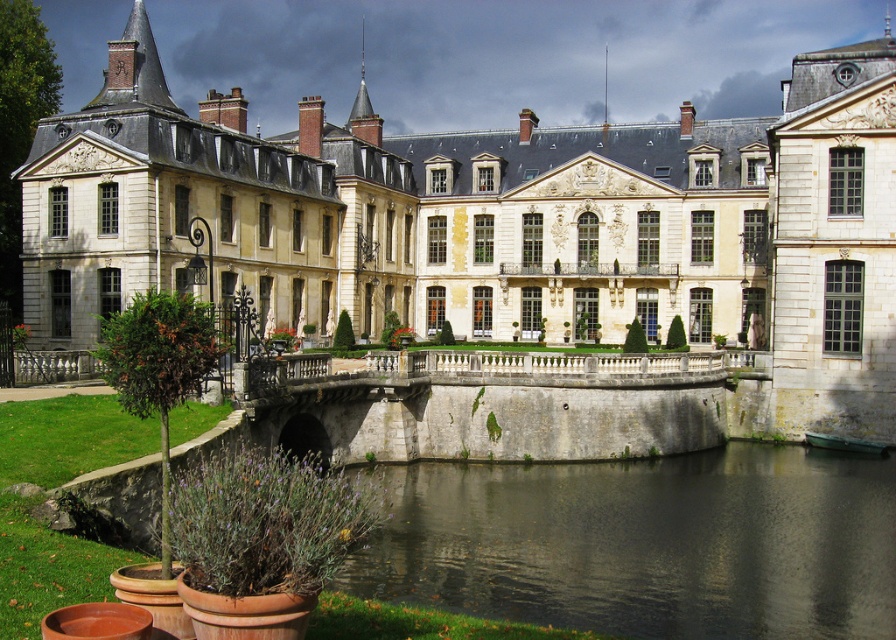
Question: Does dark gray stone river at center have a smaller size compared to gray stone bridge at center?

Choices:
 (A) no
 (B) yes

Answer: (A)

Question: Where is dark gray stone river at center located in relation to gray stone bridge at center in the image?

Choices:
 (A) above
 (B) below

Answer: (B)

Question: Does dark gray stone river at center have a smaller size compared to gray stone bridge at center?

Choices:
 (A) yes
 (B) no

Answer: (B)

Question: Which object appears farthest from the camera in this image?

Choices:
 (A) gray stone bridge at center
 (B) white stone palace at center

Answer: (B)

Question: Among these points, which one is farthest from the camera?

Choices:
 (A) (623, 467)
 (B) (573, 333)

Answer: (B)

Question: Which object is closer to the camera taking this photo?

Choices:
 (A) gray stone bridge at center
 (B) white stone palace at center

Answer: (A)